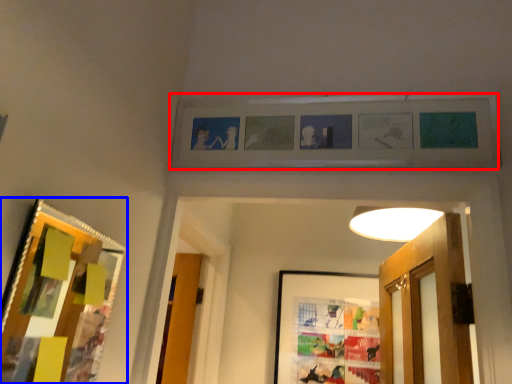
Question: Which point is closer to the camera, picture frame (highlighted by a red box) or picture frame (highlighted by a blue box)?

Choices:
 (A) picture frame
 (B) picture frame

Answer: (B)